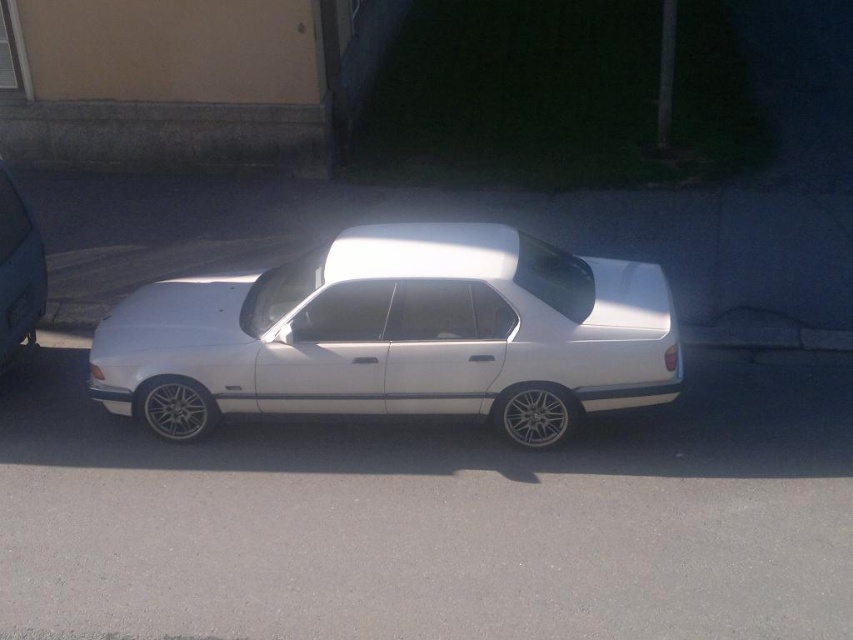
You are a delivery person trying to park your van next to the metallic silver car at left and the black plastic license plate at center. Can you estimate if there is enough space between them for your van which is 2.5 meters wide?

The metallic silver car at left might be wider than black plastic license plate at center, but without exact measurements, it is uncertain if there is enough space for a van that is 2.5 meters wide. It is recommended to measure the distance before attempting to park.

You are a parking attendant and need to direct a driver to park their car so that it aligns with the existing metallic silver car at left and black plastic license plate at center. Based on their current positions, which side should the driver move their car towards to align properly?

The metallic silver car at left is to the left of the black plastic license plate at center. To align properly, the driver should move their car towards the right side so it lines up with the black plastic license plate at center.